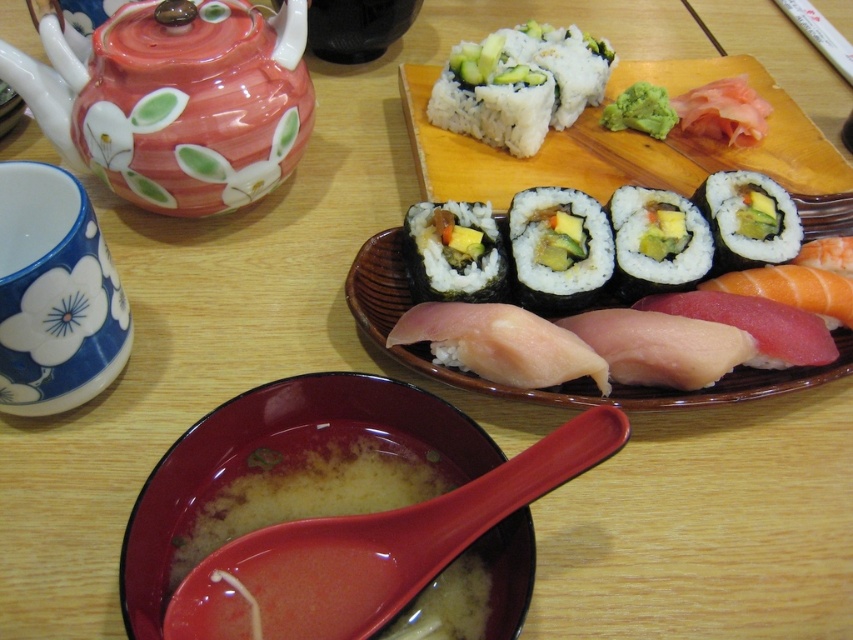
Who is lower down, matte ceramic bowl at lower center or green avocado at center?

matte ceramic bowl at lower center is lower down.

Is matte ceramic bowl at lower center bigger than green avocado at center?

Yes.

Between point (204, 451) and point (750, 170), which one is positioned in front?

Positioned in front is point (204, 451).

This screenshot has height=640, width=853. In order to click on matte ceramic bowl at lower center in this screenshot , I will do `click(280, 461)`.

Who is lower down, matte ceramic bowl at lower center or green nori at center?

Positioned lower is matte ceramic bowl at lower center.

From the picture: Is matte ceramic bowl at lower center above green nori at center?

Incorrect, matte ceramic bowl at lower center is not positioned above green nori at center.

Between point (409, 451) and point (602, 275), which one is positioned in front?

Point (409, 451) is more forward.

The height and width of the screenshot is (640, 853). In order to click on matte ceramic bowl at lower center in this screenshot , I will do `click(280, 461)`.

The image size is (853, 640). Find the location of `smooth avocado sushi at center`. smooth avocado sushi at center is located at coordinates (656, 241).